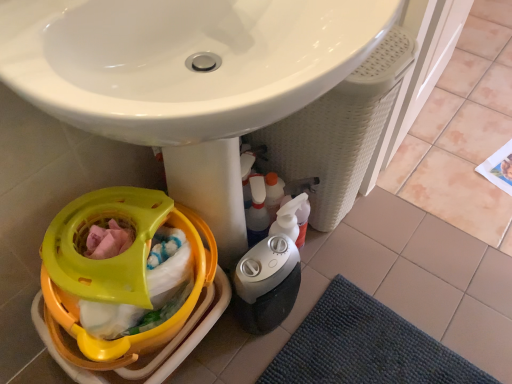
The image size is (512, 384). I want to click on free spot in front of gray plastic humidifier at lower center, so click(249, 355).